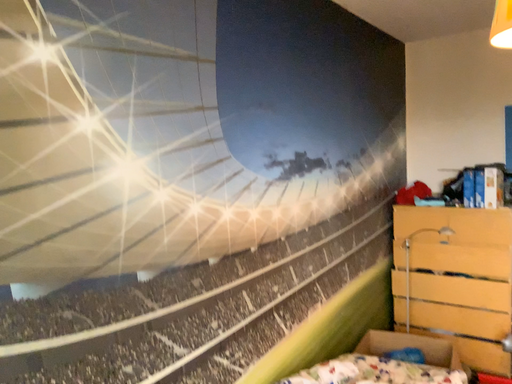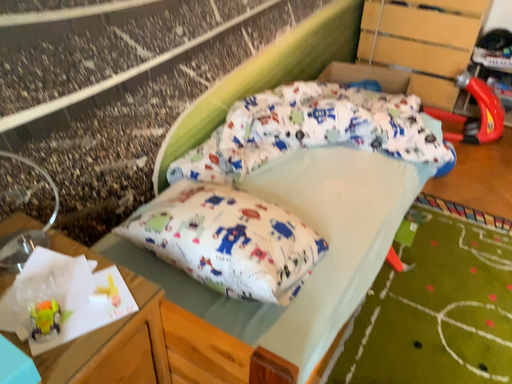
Question: How did the camera likely rotate when shooting the video?

Choices:
 (A) rotated downward
 (B) rotated upward

Answer: (A)